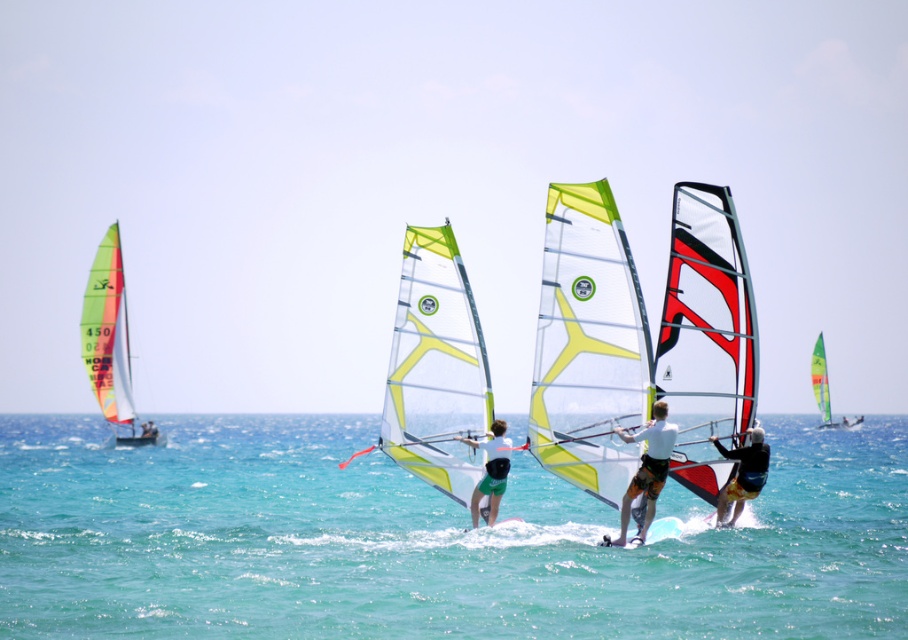
Which is more to the left, green translucent sail at left or green translucent sail at right?

green translucent sail at left is more to the left.

Does green translucent sail at left come in front of green translucent sail at right?

That is True.

Does point (115, 381) come farther from viewer compared to point (818, 333)?

No, (115, 381) is closer to viewer.

The width and height of the screenshot is (908, 640). I want to click on green translucent sail at left, so click(x=109, y=340).

Who is positioned more to the left, clear blue water at center or green translucent sail at left?

From the viewer's perspective, green translucent sail at left appears more on the left side.

What do you see at coordinates (428, 540) in the screenshot?
I see `clear blue water at center` at bounding box center [428, 540].

This screenshot has width=908, height=640. What do you see at coordinates (428, 540) in the screenshot?
I see `clear blue water at center` at bounding box center [428, 540].

Find the location of `clear blue water at center`. clear blue water at center is located at coordinates (428, 540).

Which is below, white matte windsurfing board at center or black matte windsurfer at center?

black matte windsurfer at center is below.

Does point (660, 401) come in front of point (723, 508)?

That is True.

Locate an element on the screen. The width and height of the screenshot is (908, 640). white matte windsurfing board at center is located at coordinates (647, 467).